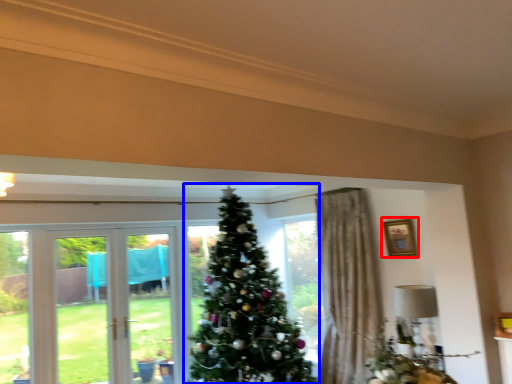
Question: Which object is further to the camera taking this photo, picture frame (highlighted by a red box) or christmas tree (highlighted by a blue box)?

Choices:
 (A) picture frame
 (B) christmas tree

Answer: (A)